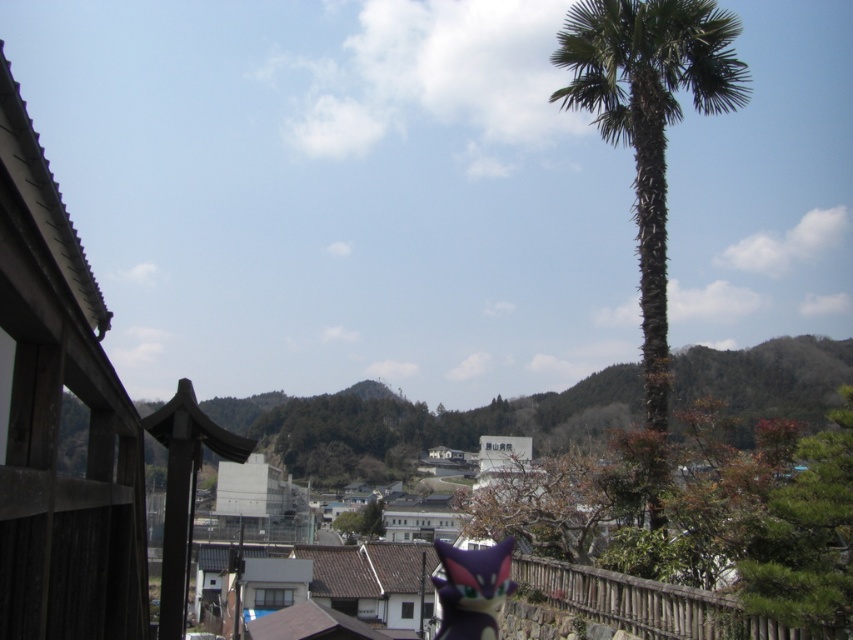
Between point (721, 100) and point (462, 582), which one is positioned behind?

The point (721, 100) is more distant.

Can you confirm if green leafy palm at right is thinner than purple matte plush toy at center?

In fact, green leafy palm at right might be wider than purple matte plush toy at center.

Between point (698, 74) and point (497, 632), which one is positioned behind?

Point (698, 74)

This screenshot has height=640, width=853. What are the coordinates of `green leafy palm at right` in the screenshot? It's located at (648, 120).

Describe the element at coordinates (730, 545) in the screenshot. I see `green leafy tree at center` at that location.

Which is in front, point (798, 545) or point (450, 548)?

Point (798, 545)

Describe the element at coordinates (730, 545) in the screenshot. This screenshot has width=853, height=640. I see `green leafy tree at center` at that location.

Where is `green leafy tree at center`? green leafy tree at center is located at coordinates (730, 545).

Is green leafy tree at center positioned in front of green leafy palm at right?

Yes, green leafy tree at center is closer to the viewer.

Find the location of a particular element. green leafy tree at center is located at coordinates (730, 545).

Describe the element at coordinates (730, 545) in the screenshot. The width and height of the screenshot is (853, 640). I see `green leafy tree at center` at that location.

Where is `green leafy tree at center`? The height and width of the screenshot is (640, 853). green leafy tree at center is located at coordinates (730, 545).